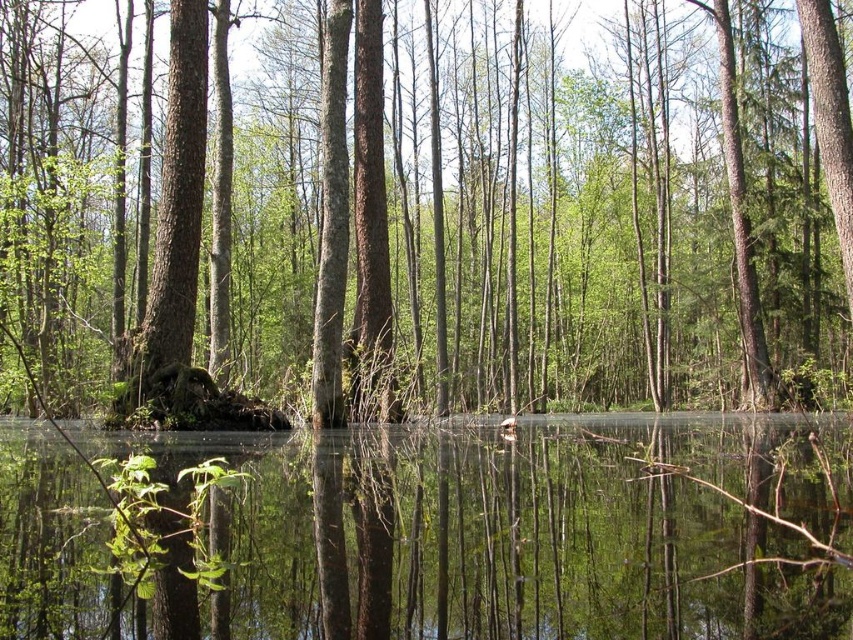
The image size is (853, 640). Describe the element at coordinates (454, 205) in the screenshot. I see `green matte tree at center` at that location.

Looking at this image, is the position of green matte tree at center more distant than that of clear water at center?

Yes, green matte tree at center is behind clear water at center.

Between point (706, 227) and point (524, 566), which one is positioned behind?

The point (706, 227) is behind.

Where is `green matte tree at center`? This screenshot has width=853, height=640. green matte tree at center is located at coordinates (454, 205).